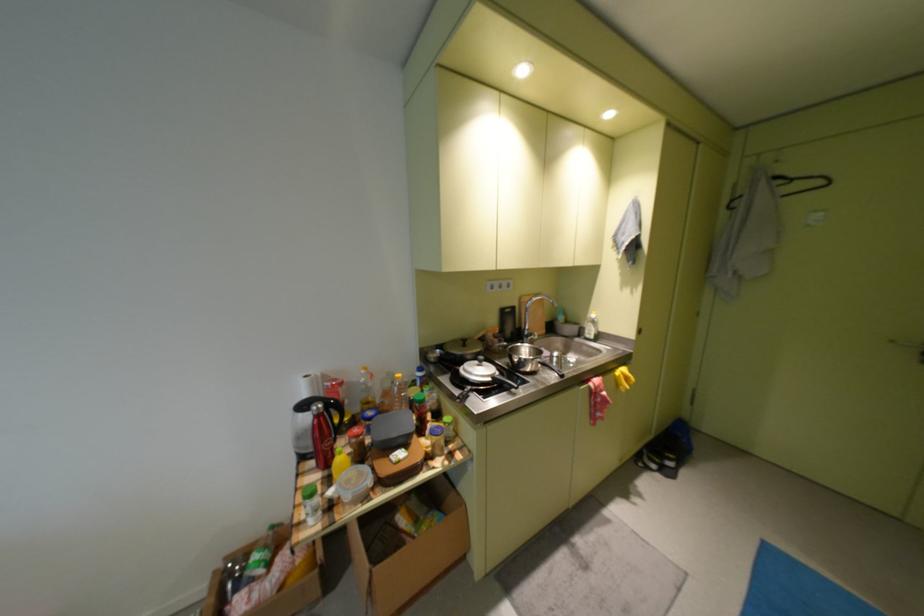
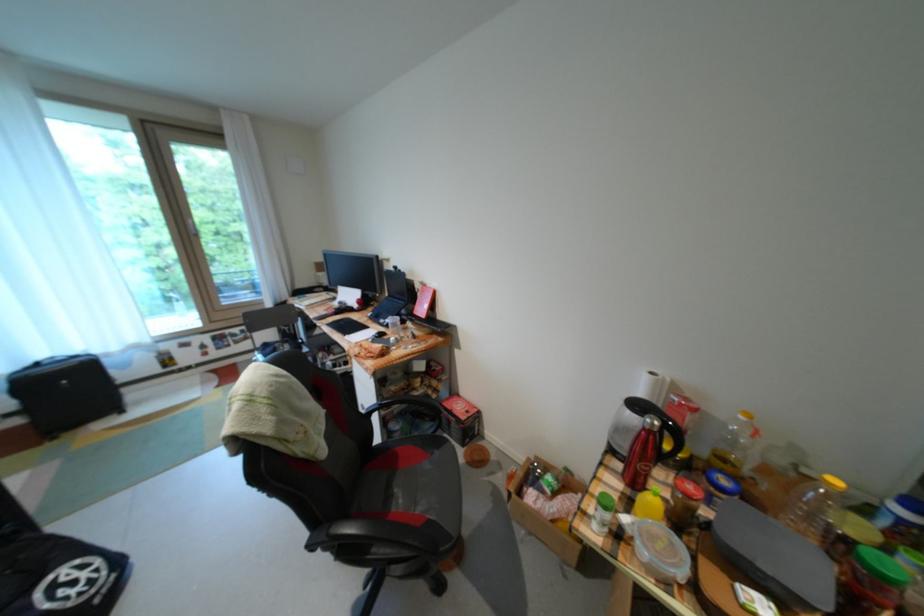
Locate, in the second image, the point that corresponds to (432,403) in the first image.

(898, 583)